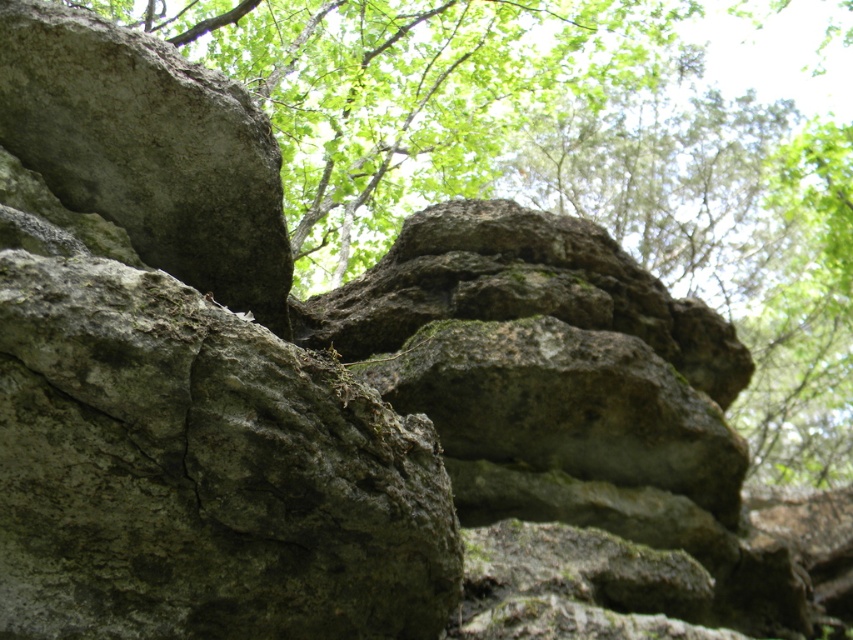
Who is positioned more to the left, green mossy rock at upper center or gray rough rock at upper left?

gray rough rock at upper left is more to the left.

Is point (846, 202) closer to viewer compared to point (224, 280)?

That is False.

Image resolution: width=853 pixels, height=640 pixels. In order to click on green mossy rock at upper center in this screenshot , I will do `click(509, 125)`.